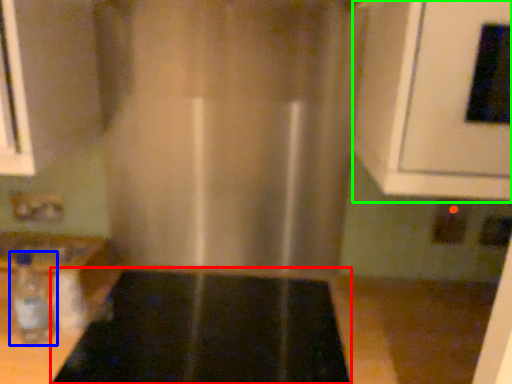
Question: Based on their relative distances, which object is farther from appliance (highlighted by a red box)? Choose from bottle (highlighted by a blue box) and oven (highlighted by a green box).

Choices:
 (A) bottle
 (B) oven

Answer: (B)